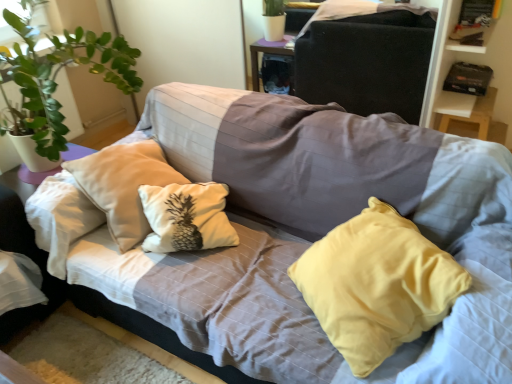
Question: From a real-world perspective, is yellow fabric pillow at center positioned over matte fabric couch at upper center based on gravity?

Choices:
 (A) no
 (B) yes

Answer: (A)

Question: Does yellow fabric pillow at center have a greater height compared to matte fabric couch at upper center?

Choices:
 (A) yes
 (B) no

Answer: (B)

Question: Is yellow fabric pillow at center not within matte fabric couch at upper center?

Choices:
 (A) yes
 (B) no

Answer: (A)

Question: From a real-world perspective, is yellow fabric pillow at center located beneath matte fabric couch at upper center?

Choices:
 (A) yes
 (B) no

Answer: (A)

Question: Can you confirm if yellow fabric pillow at center is bigger than matte fabric couch at upper center?

Choices:
 (A) no
 (B) yes

Answer: (B)

Question: From the image's perspective, is yellow fabric pillow at center above or below matte fabric couch at upper center?

Choices:
 (A) below
 (B) above

Answer: (A)

Question: From their relative heights in the image, would you say yellow fabric pillow at center is taller or shorter than matte fabric couch at upper center?

Choices:
 (A) short
 (B) tall

Answer: (A)

Question: Is yellow fabric pillow at center situated inside matte fabric couch at upper center or outside?

Choices:
 (A) outside
 (B) inside

Answer: (A)

Question: Considering the positions of yellow fabric pillow at center and matte fabric couch at upper center in the image, is yellow fabric pillow at center wider or thinner than matte fabric couch at upper center?

Choices:
 (A) thin
 (B) wide

Answer: (B)

Question: Considering the positions of black cardboard box at upper right and matte fabric couch at upper center in the image, is black cardboard box at upper right wider or thinner than matte fabric couch at upper center?

Choices:
 (A) thin
 (B) wide

Answer: (B)

Question: Relative to matte fabric couch at upper center, is black cardboard box at upper right in front or behind?

Choices:
 (A) front
 (B) behind

Answer: (A)

Question: Considering the relative positions of black cardboard box at upper right and matte fabric couch at upper center in the image provided, is black cardboard box at upper right to the left or to the right of matte fabric couch at upper center?

Choices:
 (A) right
 (B) left

Answer: (A)

Question: Is black cardboard box at upper right inside the boundaries of matte fabric couch at upper center, or outside?

Choices:
 (A) inside
 (B) outside

Answer: (B)

Question: Is point (361, 283) closer or farther from the camera than point (499, 62)?

Choices:
 (A) closer
 (B) farther

Answer: (A)

Question: From their relative heights in the image, would you say yellow fabric pillow at center is taller or shorter than black cardboard box at upper right?

Choices:
 (A) tall
 (B) short

Answer: (B)